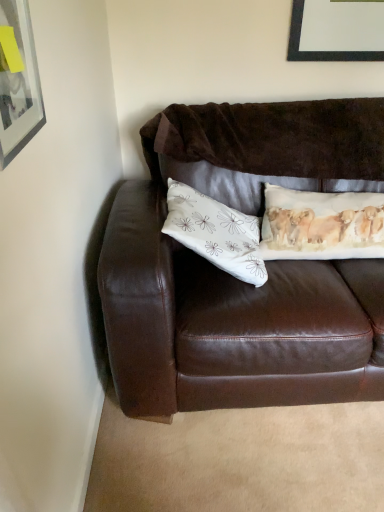
This screenshot has width=384, height=512. In order to click on matte black picture frame at upper left in this screenshot , I will do `click(18, 81)`.

What do you see at coordinates (18, 81) in the screenshot?
I see `matte black picture frame at upper left` at bounding box center [18, 81].

Locate an element on the screen. Image resolution: width=384 pixels, height=512 pixels. matte black picture frame at upper left is located at coordinates (18, 81).